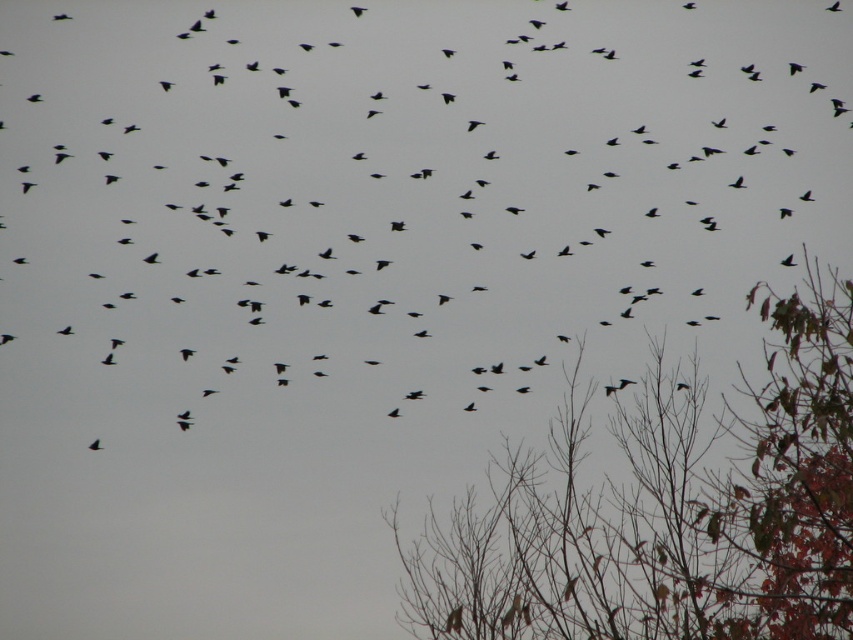
Question: Which object is closer to the camera taking this photo?

Choices:
 (A) brown leafy tree at lower right
 (B) black matte birds at center

Answer: (A)

Question: Can you confirm if black matte birds at center is positioned to the left of brown leafy tree at lower right?

Choices:
 (A) no
 (B) yes

Answer: (B)

Question: Does black matte birds at center appear on the right side of brown leafy tree at lower right?

Choices:
 (A) no
 (B) yes

Answer: (A)

Question: Among these points, which one is farthest from the camera?

Choices:
 (A) (407, 310)
 (B) (786, 310)

Answer: (A)

Question: Observing the image, what is the correct spatial positioning of black matte birds at center in reference to brown leafy tree at lower right?

Choices:
 (A) left
 (B) right

Answer: (A)